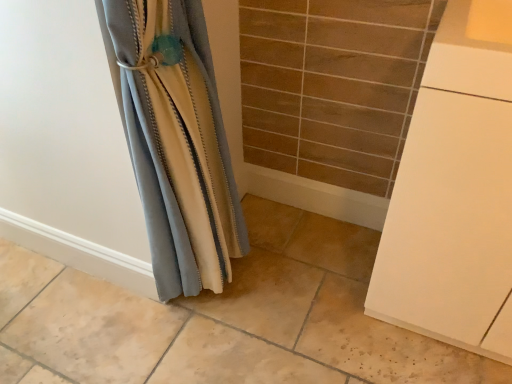
The image size is (512, 384). Describe the element at coordinates (175, 141) in the screenshot. I see `satin fabric curtain at left` at that location.

You are a GUI agent. You are given a task and a screenshot of the screen. Output one action in this format:
    pyautogui.click(x=<x>, y=<y>)
    Task: Click on the satin fabric curtain at left
    The width and height of the screenshot is (512, 384).
    Given the screenshot: What is the action you would take?
    pyautogui.click(x=175, y=141)

In order to face satin fabric curtain at left, should I rotate leftwards or rightwards?

A 7.957 degree turn to the left will do.

The width and height of the screenshot is (512, 384). What do you see at coordinates (455, 192) in the screenshot? I see `white matte cabinet at right` at bounding box center [455, 192].

Find the location of a particular element. The image size is (512, 384). white matte cabinet at right is located at coordinates (455, 192).

I want to click on satin fabric curtain at left, so click(175, 141).

Between satin fabric curtain at left and white matte cabinet at right, which one appears on the right side from the viewer's perspective?

From the viewer's perspective, white matte cabinet at right appears more on the right side.

Considering the positions of objects satin fabric curtain at left and white matte cabinet at right in the image provided, who is in front, satin fabric curtain at left or white matte cabinet at right?

white matte cabinet at right is closer to the camera.

Is point (225, 247) more distant than point (440, 267)?

That is True.

From the image's perspective, which one is positioned lower, satin fabric curtain at left or white matte cabinet at right?

white matte cabinet at right.

Consider the image. From a real-world perspective, is satin fabric curtain at left under white matte cabinet at right?

No, from a real-world perspective, satin fabric curtain at left is not under white matte cabinet at right.

In terms of width, does satin fabric curtain at left look wider or thinner when compared to white matte cabinet at right?

In the image, satin fabric curtain at left appears to be more narrow than white matte cabinet at right.

In the scene shown: Considering the sizes of objects satin fabric curtain at left and white matte cabinet at right in the image provided, who is shorter, satin fabric curtain at left or white matte cabinet at right?

white matte cabinet at right is shorter.

Considering the sizes of objects satin fabric curtain at left and white matte cabinet at right in the image provided, who is smaller, satin fabric curtain at left or white matte cabinet at right?

With smaller size is satin fabric curtain at left.

Is satin fabric curtain at left completely or partially outside of white matte cabinet at right?

satin fabric curtain at left is positioned outside white matte cabinet at right.

Is satin fabric curtain at left not near white matte cabinet at right?

No, satin fabric curtain at left is in close proximity to white matte cabinet at right.

Is satin fabric curtain at left facing away from white matte cabinet at right?

satin fabric curtain at left does not have its back to white matte cabinet at right.

How much distance is there between satin fabric curtain at left and white matte cabinet at right?

The distance of satin fabric curtain at left from white matte cabinet at right is 22.05 inches.

This screenshot has height=384, width=512. I want to click on curtain on the left side of white matte cabinet at right, so click(x=175, y=141).

Is white matte cabinet at right to the left or to the right of satin fabric curtain at left in the image?

white matte cabinet at right is positioned on satin fabric curtain at left's right side.

Is white matte cabinet at right behind satin fabric curtain at left?

No.

Is point (441, 105) positioned in front of point (237, 233)?

Yes, point (441, 105) is in front of point (237, 233).

From the image's perspective, is white matte cabinet at right located above or below satin fabric curtain at left?

white matte cabinet at right is situated lower than satin fabric curtain at left in the image.

From a real-world perspective, between white matte cabinet at right and satin fabric curtain at left, who is vertically lower?

From a 3D spatial view, white matte cabinet at right is below.

Is white matte cabinet at right wider than satin fabric curtain at left?

Indeed, white matte cabinet at right has a greater width compared to satin fabric curtain at left.

Who is shorter, white matte cabinet at right or satin fabric curtain at left?

With less height is white matte cabinet at right.

Can you confirm if white matte cabinet at right is smaller than satin fabric curtain at left?

Actually, white matte cabinet at right might be larger than satin fabric curtain at left.

Is satin fabric curtain at left located within white matte cabinet at right?

Actually, satin fabric curtain at left is outside white matte cabinet at right.

Is white matte cabinet at right touching satin fabric curtain at left?

No, white matte cabinet at right is not touching satin fabric curtain at left.

Is white matte cabinet at right positioned with its back to satin fabric curtain at left?

That's not correct — white matte cabinet at right is not looking away from satin fabric curtain at left.

How many degrees apart are the facing directions of white matte cabinet at right and satin fabric curtain at left?

88 degrees separate the facing orientations of white matte cabinet at right and satin fabric curtain at left.

Measure the distance from white matte cabinet at right to satin fabric curtain at left.

white matte cabinet at right is 22.05 inches from satin fabric curtain at left.

Where is `cabinetry that is in front of the satin fabric curtain at left`? cabinetry that is in front of the satin fabric curtain at left is located at coordinates (455, 192).

Locate an element on the screen. The image size is (512, 384). cabinetry in front of the satin fabric curtain at left is located at coordinates (455, 192).

Find the location of a particular element. This screenshot has width=512, height=384. cabinetry on the right of satin fabric curtain at left is located at coordinates (455, 192).